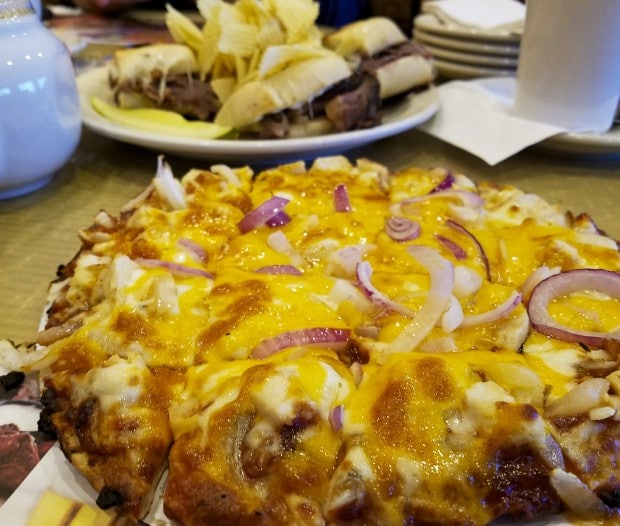
Find the location of a particular element. This screenshot has height=526, width=620. napkin is located at coordinates (467, 125), (472, 26).